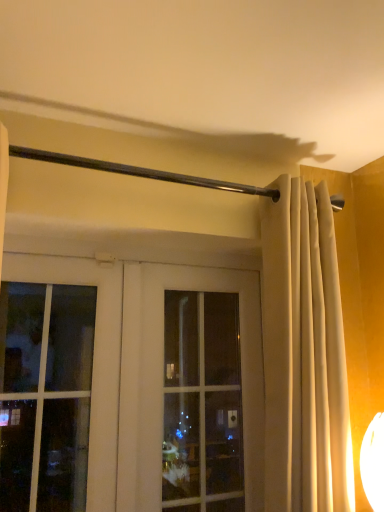
Question: Could you tell me if clear glass window at center is facing white glass door at center?

Choices:
 (A) yes
 (B) no

Answer: (A)

Question: From the image's perspective, is clear glass window at center above white glass door at center?

Choices:
 (A) no
 (B) yes

Answer: (A)

Question: Is clear glass window at center not near white glass door at center?

Choices:
 (A) no
 (B) yes

Answer: (A)

Question: From a real-world perspective, is clear glass window at center located beneath white glass door at center?

Choices:
 (A) no
 (B) yes

Answer: (B)

Question: Considering the relative positions of clear glass window at center and white glass door at center in the image provided, is clear glass window at center to the left of white glass door at center from the viewer's perspective?

Choices:
 (A) no
 (B) yes

Answer: (A)

Question: From a real-world perspective, relative to beige fabric curtain at center, is white glass door at center vertically above or below?

Choices:
 (A) below
 (B) above

Answer: (A)

Question: Is white glass door at center in front of or behind beige fabric curtain at center in the image?

Choices:
 (A) front
 (B) behind

Answer: (B)

Question: Considering the relative positions of white glass door at center and beige fabric curtain at center in the image provided, is white glass door at center to the left or to the right of beige fabric curtain at center?

Choices:
 (A) left
 (B) right

Answer: (A)

Question: In terms of height, does white glass door at center look taller or shorter compared to beige fabric curtain at center?

Choices:
 (A) tall
 (B) short

Answer: (B)

Question: Is point (306, 313) closer or farther from the camera than point (241, 356)?

Choices:
 (A) closer
 (B) farther

Answer: (A)

Question: Looking at the image, does beige fabric curtain at center seem bigger or smaller compared to clear glass window at center?

Choices:
 (A) small
 (B) big

Answer: (B)

Question: Would you say beige fabric curtain at center is inside or outside clear glass window at center?

Choices:
 (A) inside
 (B) outside

Answer: (B)

Question: Is beige fabric curtain at center wider or thinner than clear glass window at center?

Choices:
 (A) thin
 (B) wide

Answer: (B)

Question: From a real-world perspective, relative to white glass door at center, is clear glass window at center vertically above or below?

Choices:
 (A) above
 (B) below

Answer: (B)

Question: Is clear glass window at center bigger or smaller than white glass door at center?

Choices:
 (A) big
 (B) small

Answer: (A)